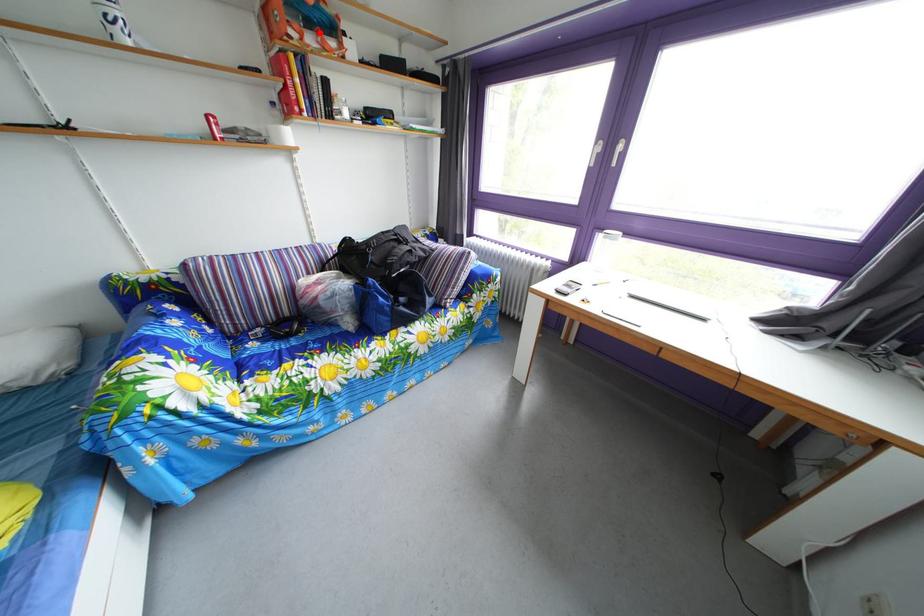
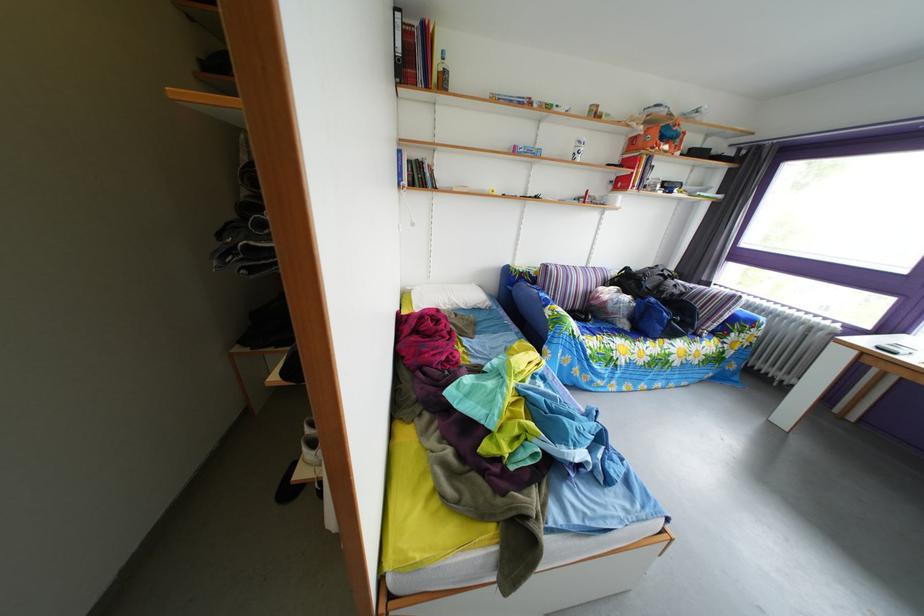
Find the pixel in the second image that matches the highlighted location in the first image.

(673, 147)